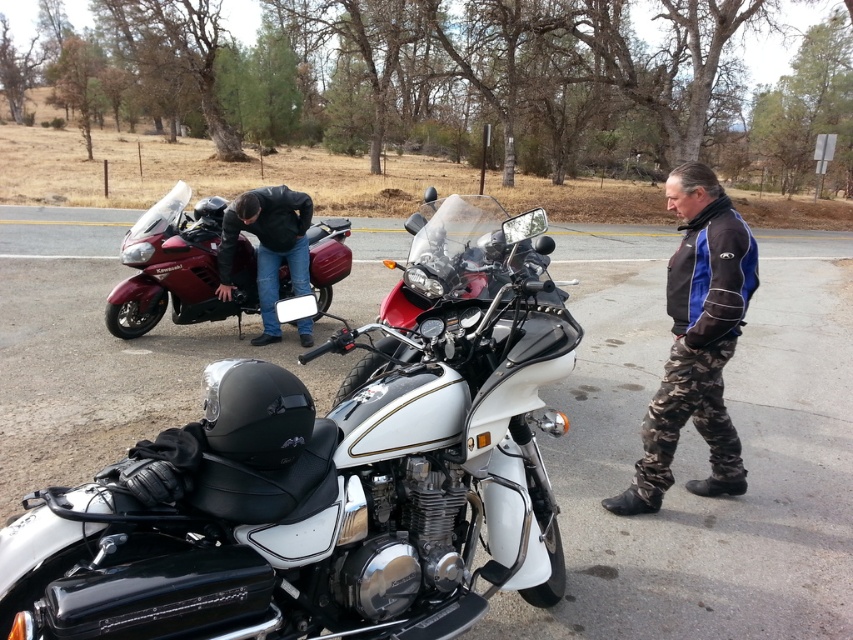
Can you confirm if camouflage pants at right is positioned below dark blue leather jacket at left?

Yes.

Between camouflage pants at right and dark blue leather jacket at left, which one has more height?

camouflage pants at right

Image resolution: width=853 pixels, height=640 pixels. In order to click on camouflage pants at right in this screenshot , I will do `click(695, 342)`.

Identify the location of camouflage pants at right. The width and height of the screenshot is (853, 640). pyautogui.click(x=695, y=342).

The width and height of the screenshot is (853, 640). Describe the element at coordinates (178, 268) in the screenshot. I see `shiny maroon motorcycle at left` at that location.

Does point (215, 275) lie behind point (273, 336)?

No, (215, 275) is in front of (273, 336).

Is point (242, 237) positioned after point (218, 296)?

Yes, point (242, 237) is farther from viewer.

You are a GUI agent. You are given a task and a screenshot of the screen. Output one action in this format:
    pyautogui.click(x=<x>, y=<y>)
    Task: Click on the shiny maroon motorcycle at left
    
    Given the screenshot: What is the action you would take?
    pyautogui.click(x=178, y=268)

Is camouflage pants at right to the right of shiny maroon motorcycle at left from the viewer's perspective?

Correct, you'll find camouflage pants at right to the right of shiny maroon motorcycle at left.

Is camouflage pants at right smaller than shiny maroon motorcycle at left?

Yes.

Is point (680, 216) less distant than point (123, 317)?

That is True.

At what (x,y) coordinates should I click in order to perform the action: click on camouflage pants at right. Please return your answer as a coordinate pair (x, y). The height and width of the screenshot is (640, 853). Looking at the image, I should click on (695, 342).